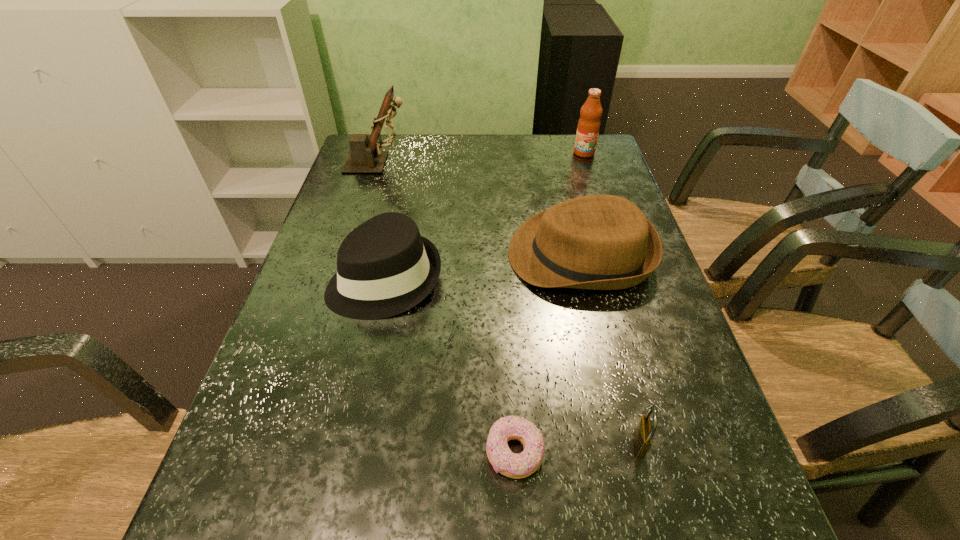
Where is `free spot that satisfies the following two spatial constraints: 1. on the back side of the padlock; 2. on the front-facing side of the figurine`? free spot that satisfies the following two spatial constraints: 1. on the back side of the padlock; 2. on the front-facing side of the figurine is located at coordinates (566, 163).

Find the location of a particular element. The width and height of the screenshot is (960, 540). vacant region that satisfies the following two spatial constraints: 1. on the front-facing side of the figurine; 2. on the right side of the shortest object is located at coordinates (288, 453).

Find the location of `vacant point that satisfies the following two spatial constraints: 1. on the front-facing side of the left fedora; 2. on the right side of the figurine`. vacant point that satisfies the following two spatial constraints: 1. on the front-facing side of the left fedora; 2. on the right side of the figurine is located at coordinates (342, 279).

Identify the location of vacant point that satisfies the following two spatial constraints: 1. on the front-facing side of the left fedora; 2. on the right side of the figurine. The height and width of the screenshot is (540, 960). (342, 279).

Identify the location of free location that satisfies the following two spatial constraints: 1. on the front-facing side of the tallest object; 2. on the right side of the doughnut. This screenshot has height=540, width=960. (288, 453).